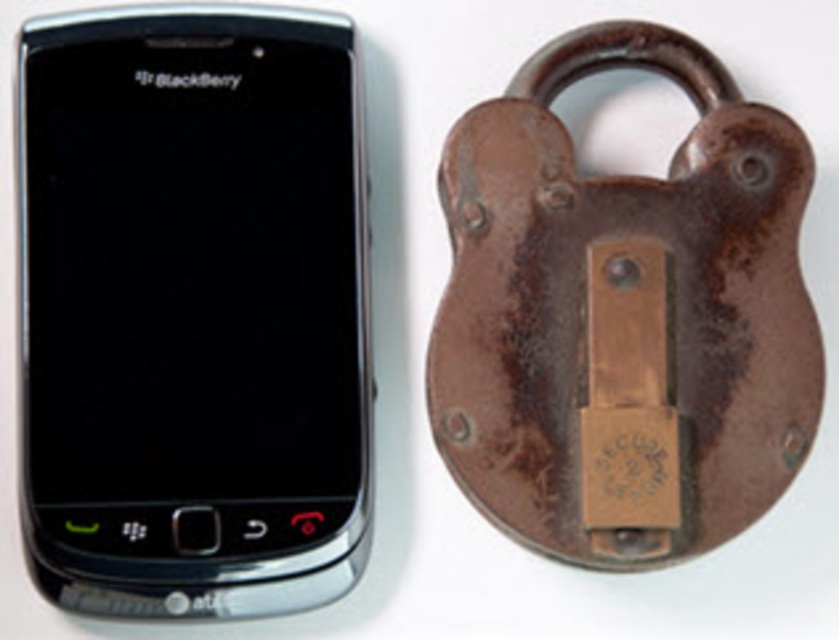
You are trying to determine which object takes up more space in the image. Looking at the black glossy smartphone at left and the rusty metal padlock at right, which one is smaller in size?

The black glossy smartphone at left occupies less space than the rusty metal padlock at right, so the smartphone is smaller in size.

You are organizing items on a shelf and need to place the black glossy smartphone at left and the rusty metal padlock at right. If you want to arrange them from left to right in the order they appear in the image, which item should be placed first on the left side of the shelf?

The black glossy smartphone at left should be placed first on the left side of the shelf since it is positioned to the left of the rusty metal padlock at right in the image.

You are standing in front of a plain white background with a black glossy smartphone at left. There is a point at coordinates (191, 310). Which object is this point located on?

The point at coordinates (191, 310) is located on the black glossy smartphone at left.